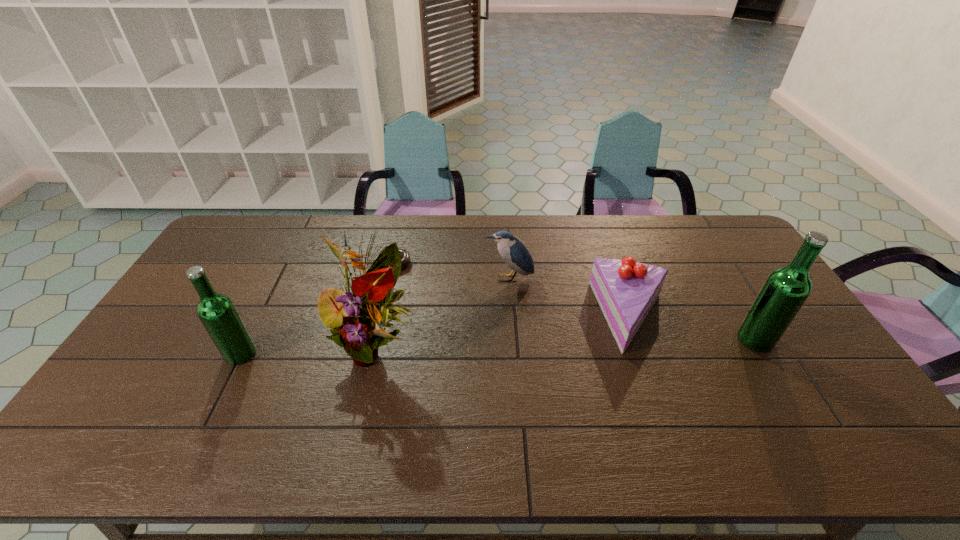
What are the coordinates of `vacant space that satisfies the following two spatial constraints: 1. on the front side of the fifth tallest object; 2. on the right side of the taller beer bottle` in the screenshot? It's located at (641, 340).

I want to click on free space that satisfies the following two spatial constraints: 1. on the back side of the second object from right to left; 2. on the left side of the left beer bottle, so click(259, 316).